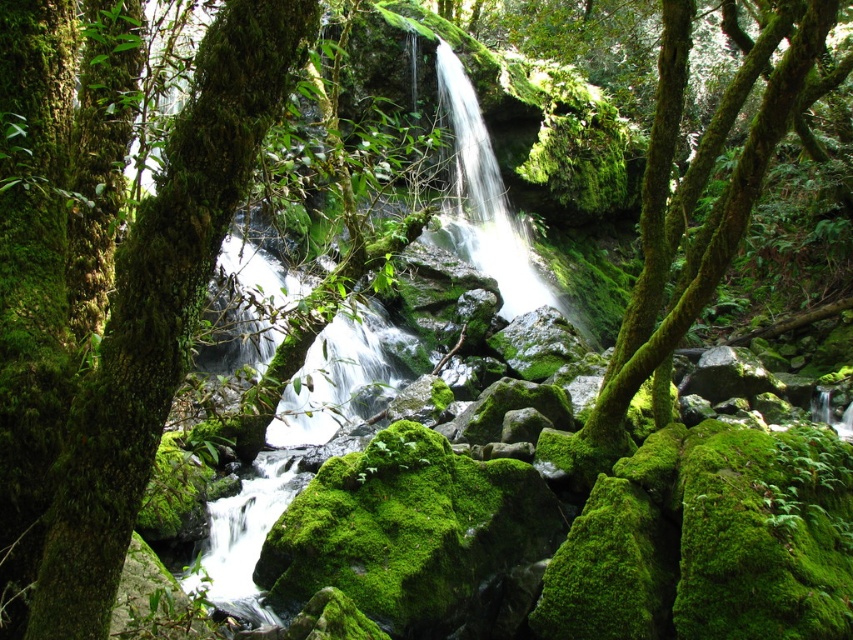
You are standing in the forest and want to locate the green mossy tree at left. What are the coordinates where you should look?

The green mossy tree at left is located at coordinates point (161, 307).

You are a hiker standing at the edge of the forest, looking at the green mossy tree at center and the white frothy water at center. Which object is taller?

The green mossy tree at center is taller than the white frothy water at center.